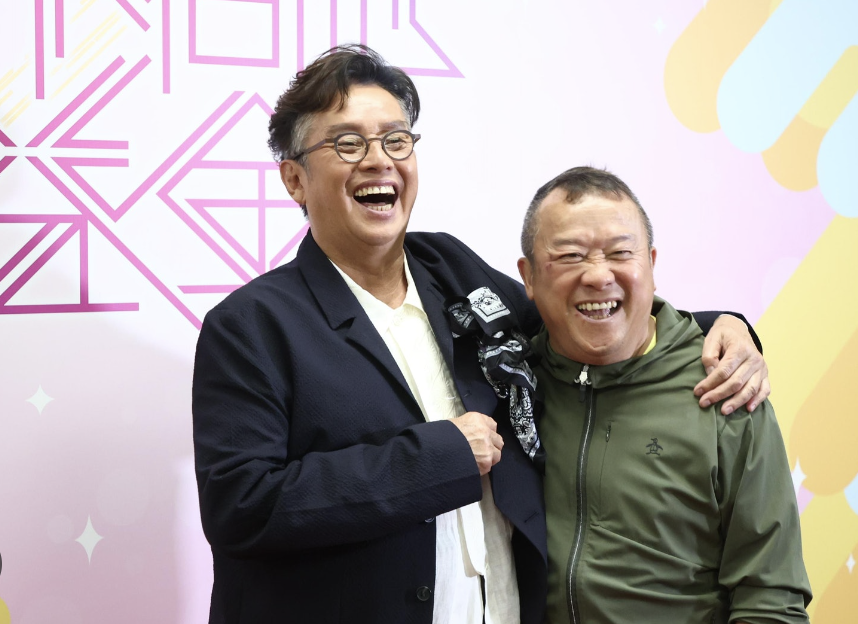
Where is `wall`? This screenshot has width=858, height=624. wall is located at coordinates (763, 263), (92, 410).